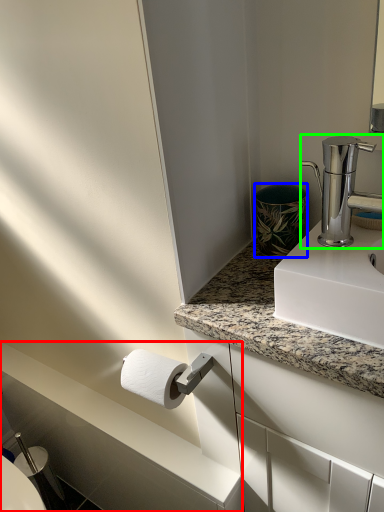
Question: Based on their relative distances, which object is nearer to counter top (highlighted by a red box)? Choose from appliance (highlighted by a blue box) and tap (highlighted by a green box).

Choices:
 (A) appliance
 (B) tap

Answer: (A)